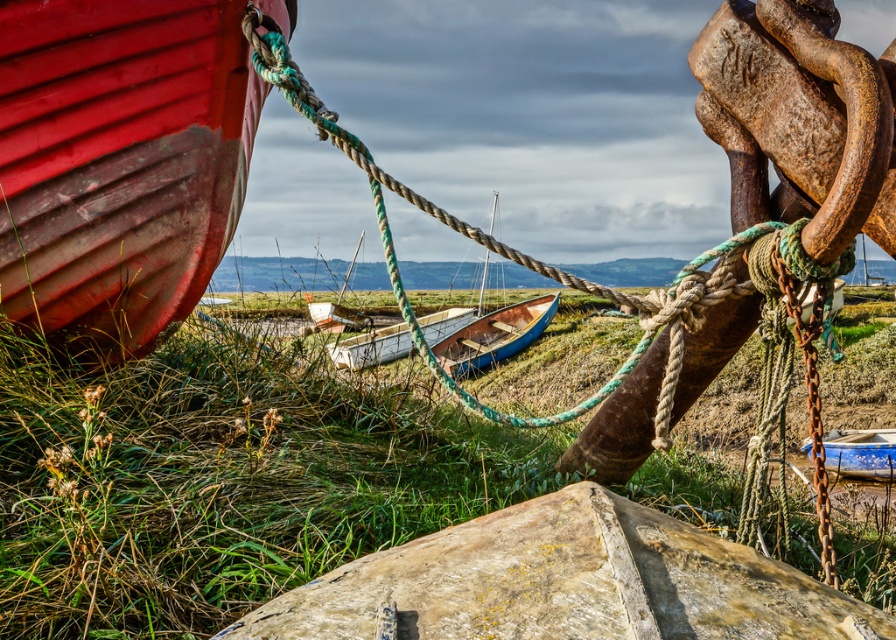
Question: Can you confirm if blue wooden boat at center is smaller than blue painted wood boat at lower right?

Choices:
 (A) yes
 (B) no

Answer: (B)

Question: Is blue wooden boat at center below blue painted wood boat at lower right?

Choices:
 (A) no
 (B) yes

Answer: (A)

Question: Which object appears closest to the camera in this image?

Choices:
 (A) blue painted wood boat at lower right
 (B) blue wooden boat at center

Answer: (A)

Question: Which point is farther from the camera taking this photo?

Choices:
 (A) (128, 134)
 (B) (397, 353)

Answer: (B)

Question: Which of the following is the farthest from the observer?

Choices:
 (A) blue wooden boat at center
 (B) green grass at lower left

Answer: (A)

Question: Does green grass at lower left appear under blue wooden boat at center?

Choices:
 (A) no
 (B) yes

Answer: (A)